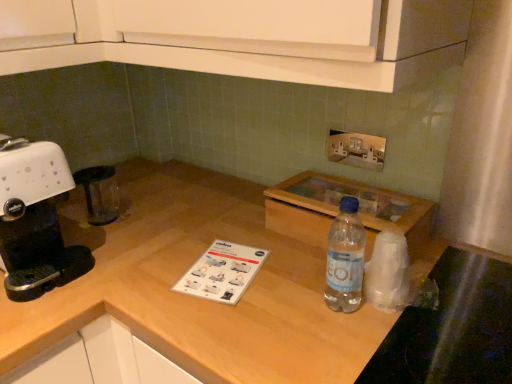
This screenshot has width=512, height=384. Find the location of `vacant space to the right of transparent plastic bag at right`. vacant space to the right of transparent plastic bag at right is located at coordinates (449, 284).